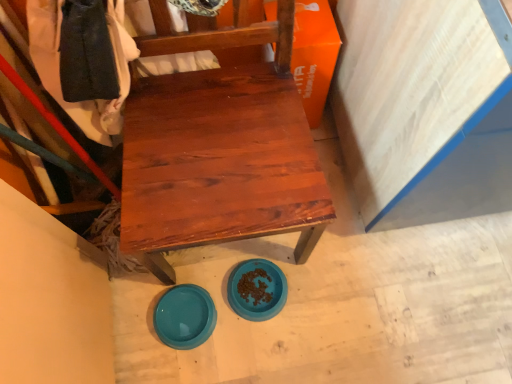
At what (x,y) coordinates should I click in order to perform the action: click on vacant space to the right of blue plastic bowl at lower center, the 1th plate positioned from the right. Please return your answer as a coordinate pair (x, y). Image resolution: width=512 pixels, height=384 pixels. Looking at the image, I should click on (318, 296).